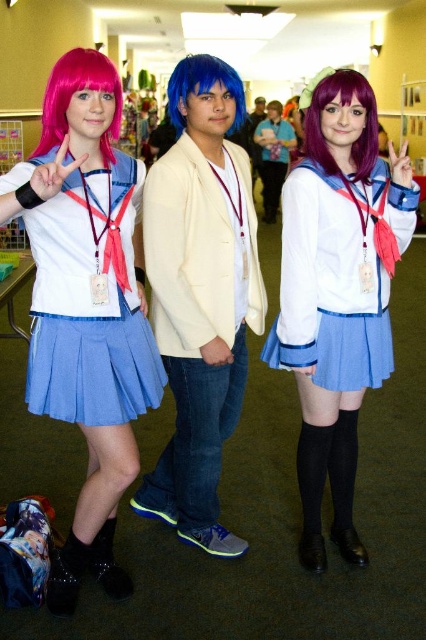
You are a photographer at the convention center and need to position a spotlight exactly at the location of the blue synthetic wig at center. According to the coordinates provided, where should you aim the spotlight?

The blue synthetic wig at center is located at coordinates point (204, 88), so the spotlight should be aimed at that exact point.

You are a photographer at the convention and need to capture a closeup shot of both the purple silky wig at center and the blue synthetic wig at center without any part of them being cut off. Given their sizes, which wig should you focus on first to ensure it fits within the frame?

The purple silky wig at center occupies less space than the blue synthetic wig at center, so you should focus on the blue synthetic wig at center first since it is larger and requires more space to fit entirely within the frame.

From the picture: You are a photographer at a convention center and want to take a photo of the blue synthetic wig at center and the blue matte hair at center. Which object should you focus on first if you want to capture both in the frame without adjusting your camera angle?

The blue synthetic wig at center has a lesser height compared to blue matte hair at center, so you should focus on the blue synthetic wig at center first to ensure it is in frame before the taller blue matte hair at center.